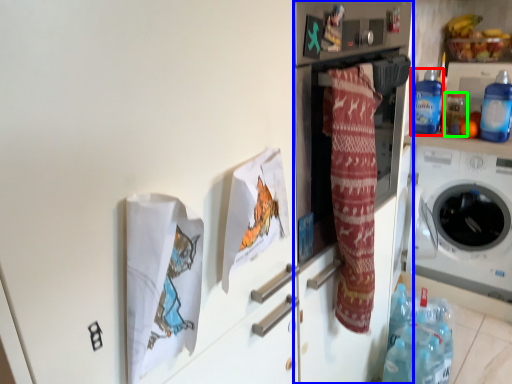
Question: Which is farther away from bottle (highlighted by a red box)? fridge (highlighted by a blue box) or bottle (highlighted by a green box)?

Choices:
 (A) fridge
 (B) bottle

Answer: (A)